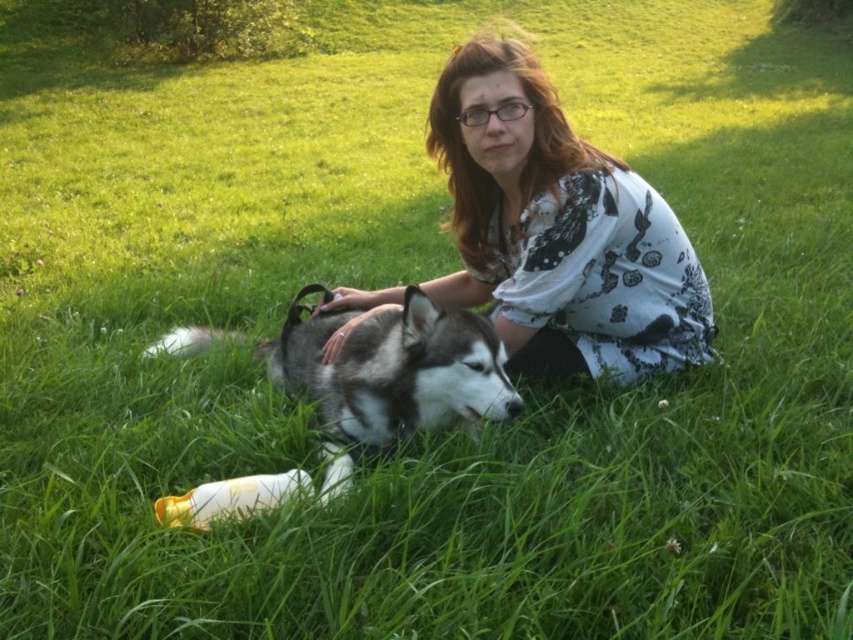
Is white floral shirt at center to the left of gray-furred husky at center from the viewer's perspective?

No, white floral shirt at center is not to the left of gray-furred husky at center.

Who is more distant from viewer, (556, 106) or (341, 316)?

Positioned behind is point (341, 316).

This screenshot has height=640, width=853. Identify the location of white floral shirt at center. (558, 228).

Can you confirm if white floral shirt at center is positioned to the left of white plastic bottle at lower center?

In fact, white floral shirt at center is to the right of white plastic bottle at lower center.

What do you see at coordinates (558, 228) in the screenshot? I see `white floral shirt at center` at bounding box center [558, 228].

Between point (523, 282) and point (219, 497), which one is positioned in front?

Positioned in front is point (219, 497).

What are the coordinates of `white floral shirt at center` in the screenshot? It's located at (558, 228).

Is gray-furred husky at center behind white plastic bottle at lower center?

That is True.

In the scene shown: How far apart are gray-furred husky at center and white plastic bottle at lower center?

gray-furred husky at center is 15.09 inches away from white plastic bottle at lower center.

Describe the element at coordinates (390, 374) in the screenshot. I see `gray-furred husky at center` at that location.

Identify the location of gray-furred husky at center. (390, 374).